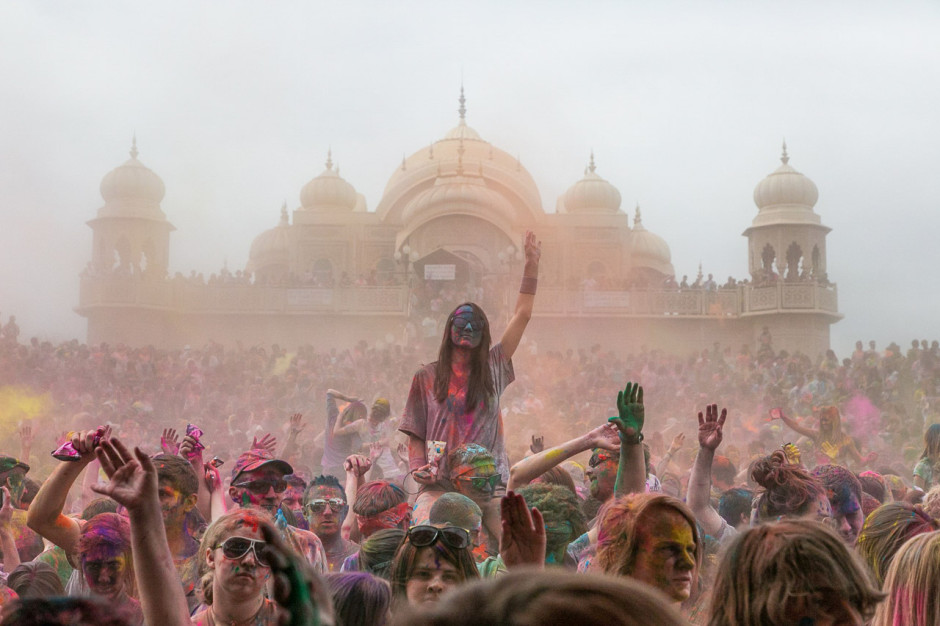
Find the location of `railing on upper story platform`. railing on upper story platform is located at coordinates (655, 305), (227, 300).